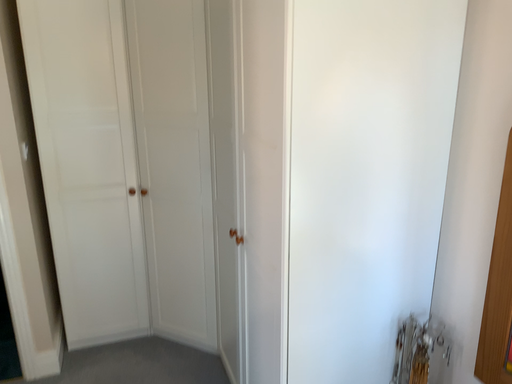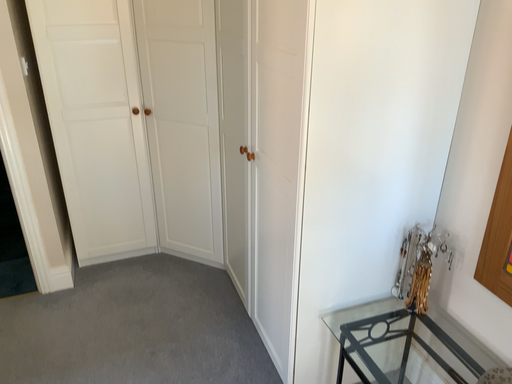
Question: Which way did the camera rotate in the video?

Choices:
 (A) rotated upward
 (B) rotated downward

Answer: (B)